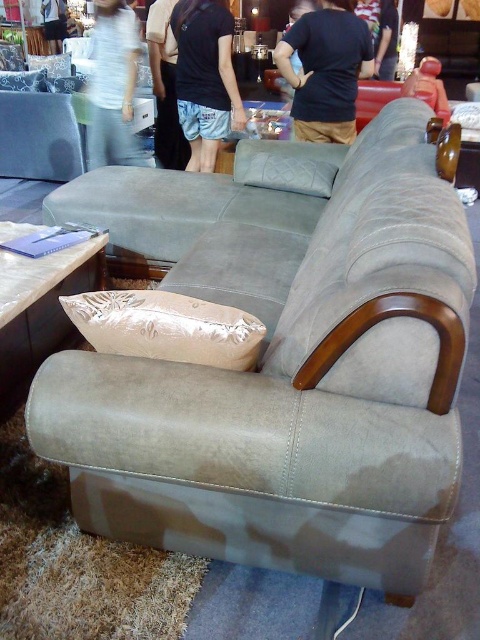
Question: Does blue denim shorts at center appear on the right side of light brown fabric pants at center?

Choices:
 (A) yes
 (B) no

Answer: (A)

Question: Does satin white table at lower left appear on the right side of dark blue shirt at upper center?

Choices:
 (A) no
 (B) yes

Answer: (A)

Question: Which of the following is the farthest from the observer?

Choices:
 (A) (29, 90)
 (B) (259, 173)
 (C) (112, 349)

Answer: (A)

Question: Is suede cushion at center to the left of light brown fabric pants at center from the viewer's perspective?

Choices:
 (A) yes
 (B) no

Answer: (B)

Question: Which point is closer to the camera?

Choices:
 (A) (219, 28)
 (B) (153, 83)
 (C) (231, 330)

Answer: (C)

Question: Which object is the closest to the blue denim shorts at center?

Choices:
 (A) white cotton shirt at upper left
 (B) satin white table at lower left
 (C) light brown fabric pants at center
 (D) dark blue shirt at upper center

Answer: (A)